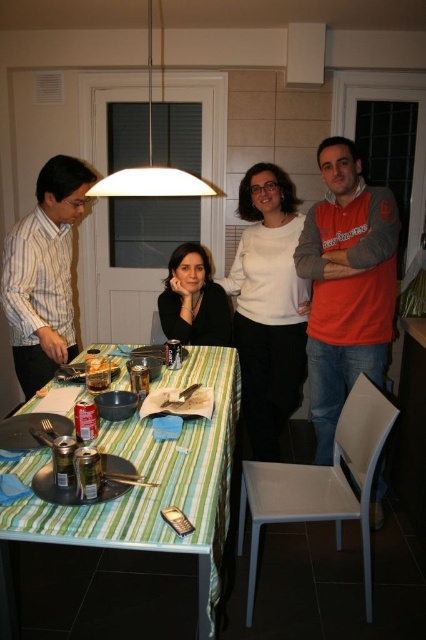
Question: Which object appears closest to the camera in this image?

Choices:
 (A) green striped tablecloth at center
 (B) white matte lampshade at upper center
 (C) matte black sweater at center
 (D) orange fleece jacket at right

Answer: (A)

Question: Is green striped tablecloth at center behind white matte lampshade at upper center?

Choices:
 (A) yes
 (B) no

Answer: (B)

Question: Which point is farther to the camera?

Choices:
 (A) (216, 340)
 (B) (288, 300)
 (C) (328, 236)

Answer: (A)

Question: Does orange fleece jacket at right appear over shiny metallic can at table center?

Choices:
 (A) yes
 (B) no

Answer: (A)

Question: Based on their relative distances, which object is farther from the striped cotton shirt at left?

Choices:
 (A) green striped tablecloth at center
 (B) white matte sweater at center
 (C) white matte lampshade at upper center

Answer: (C)

Question: From the image, what is the correct spatial relationship of orange fleece jacket at right in relation to matte black sweater at center?

Choices:
 (A) above
 (B) below

Answer: (B)